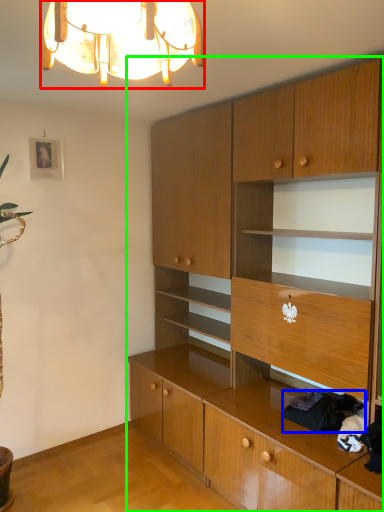
Question: Which object is positioned closest to lamp (highlighted by a red box)? Select from clothing (highlighted by a blue box) and cabinetry (highlighted by a green box).

Choices:
 (A) clothing
 (B) cabinetry

Answer: (B)